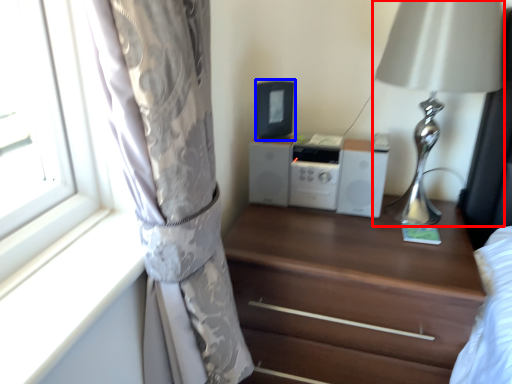
Question: Among these objects, which one is farthest to the camera, table lamp (highlighted by a red box) or appliance (highlighted by a blue box)?

Choices:
 (A) table lamp
 (B) appliance

Answer: (B)